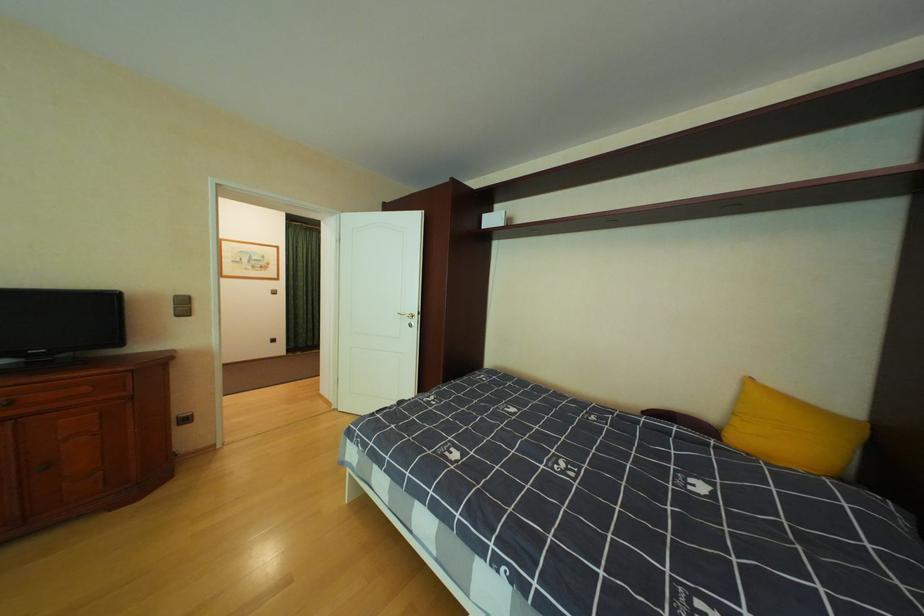
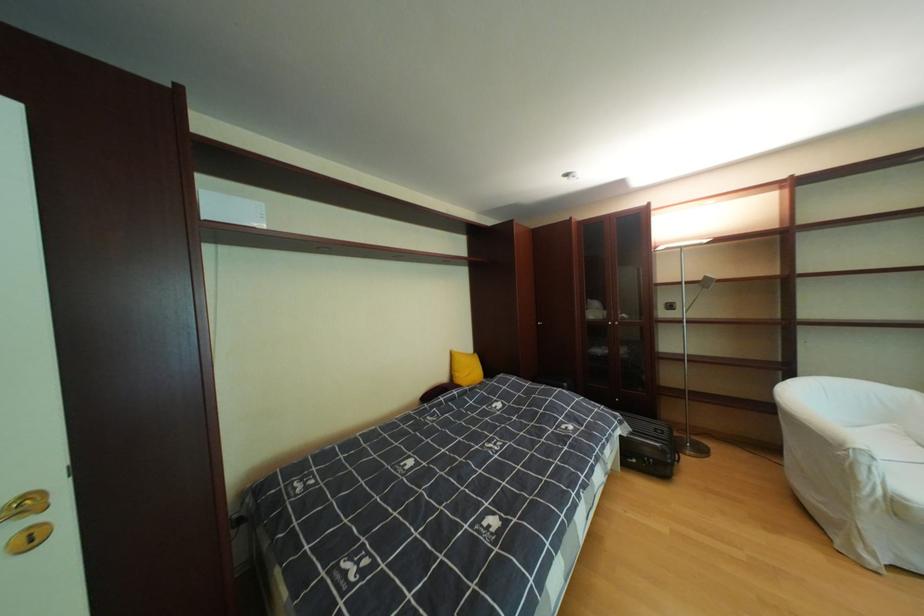
Where in the second image is the point corresponding to point (423, 326) from the first image?

(43, 541)